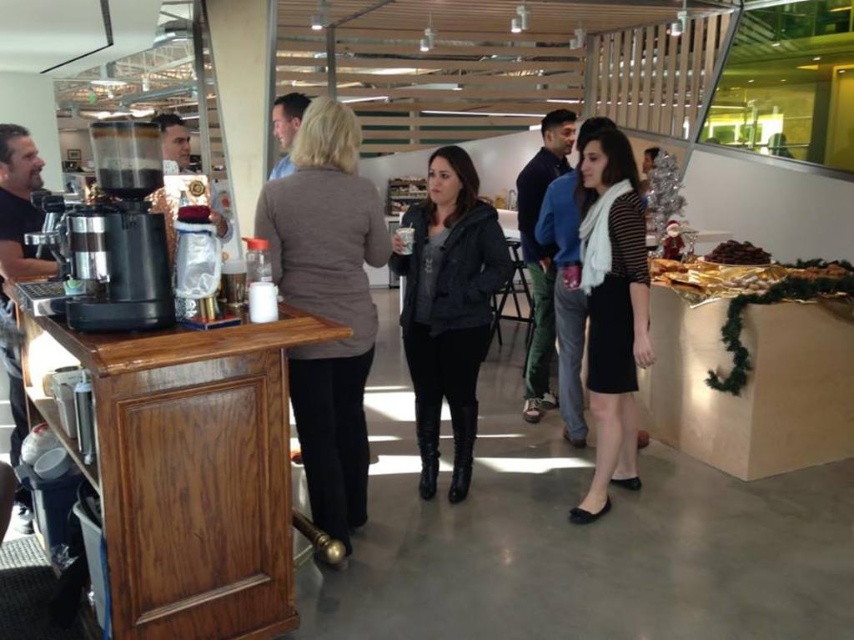
Does black matte skirt at center have a lesser height compared to dark brown leather jacket at left?

No.

This screenshot has width=854, height=640. What do you see at coordinates (612, 310) in the screenshot?
I see `black matte skirt at center` at bounding box center [612, 310].

The width and height of the screenshot is (854, 640). What do you see at coordinates (612, 310) in the screenshot? I see `black matte skirt at center` at bounding box center [612, 310].

Image resolution: width=854 pixels, height=640 pixels. Identify the location of black matte skirt at center. (612, 310).

Is brown woolen sweater at center behind metallic silver coffee machine at left?

That is True.

Can you confirm if brown woolen sweater at center is positioned above metallic silver coffee machine at left?

No.

Is point (290, 211) less distant than point (127, 308)?

No, it is behind (127, 308).

Locate an element on the screen. The width and height of the screenshot is (854, 640). brown woolen sweater at center is located at coordinates (328, 304).

Which is more to the left, brown woolen sweater at center or dark brown roasted beans at upper right?

Positioned to the left is brown woolen sweater at center.

Locate an element on the screen. brown woolen sweater at center is located at coordinates (328, 304).